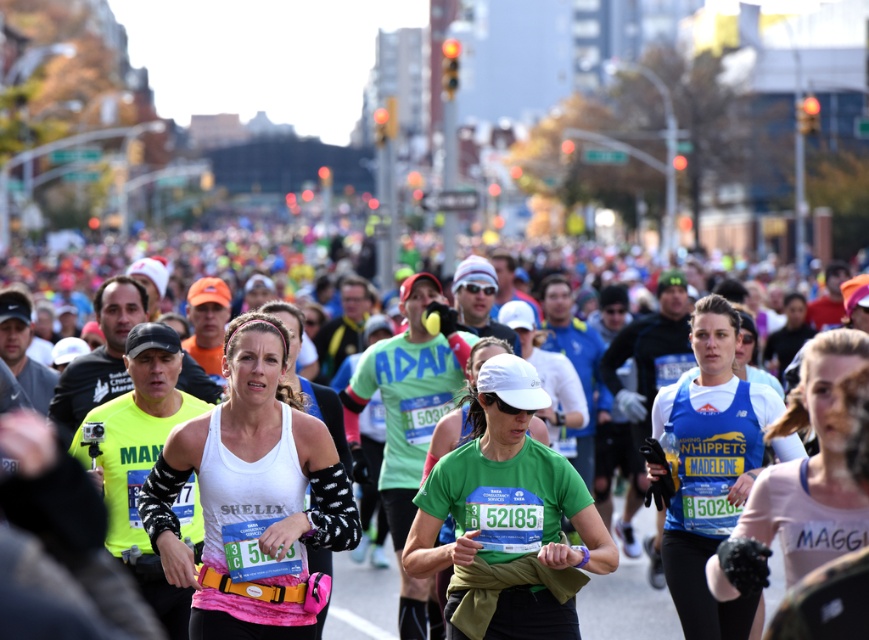
Is white matte tank top at center wider than pink fabric at center?

Indeed, white matte tank top at center has a greater width compared to pink fabric at center.

Can you confirm if white matte tank top at center is positioned above pink fabric at center?

Incorrect, white matte tank top at center is not positioned above pink fabric at center.

Who is more distant from viewer, [229,422] or [841,397]?

The point [229,422] is behind.

I want to click on white matte tank top at center, so click(x=251, y=499).

Who is shorter, green fabric shirt at center or blue fabric shirt at center?

green fabric shirt at center is shorter.

Who is more forward, (475, 472) or (697, 362)?

Positioned in front is point (475, 472).

At what (x,y) coordinates should I click in order to perform the action: click on green fabric shirt at center. Please return your answer as a coordinate pair (x, y). Looking at the image, I should click on (507, 520).

This screenshot has height=640, width=869. What do you see at coordinates (251, 499) in the screenshot?
I see `white matte tank top at center` at bounding box center [251, 499].

Is white matte tank top at center wider than white fabric runners at center?

In fact, white matte tank top at center might be narrower than white fabric runners at center.

Image resolution: width=869 pixels, height=640 pixels. What do you see at coordinates (251, 499) in the screenshot? I see `white matte tank top at center` at bounding box center [251, 499].

Where is `white matte tank top at center`? The height and width of the screenshot is (640, 869). white matte tank top at center is located at coordinates (251, 499).